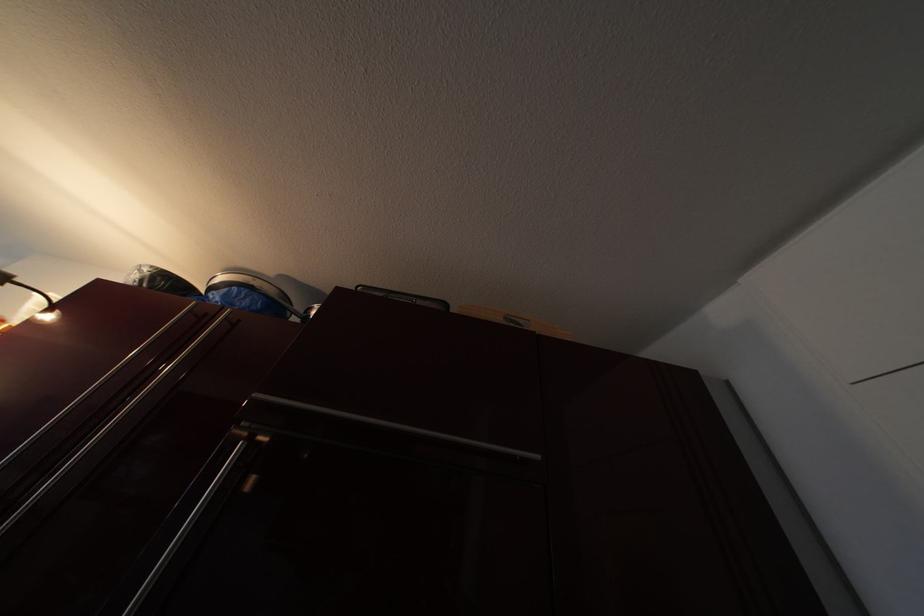
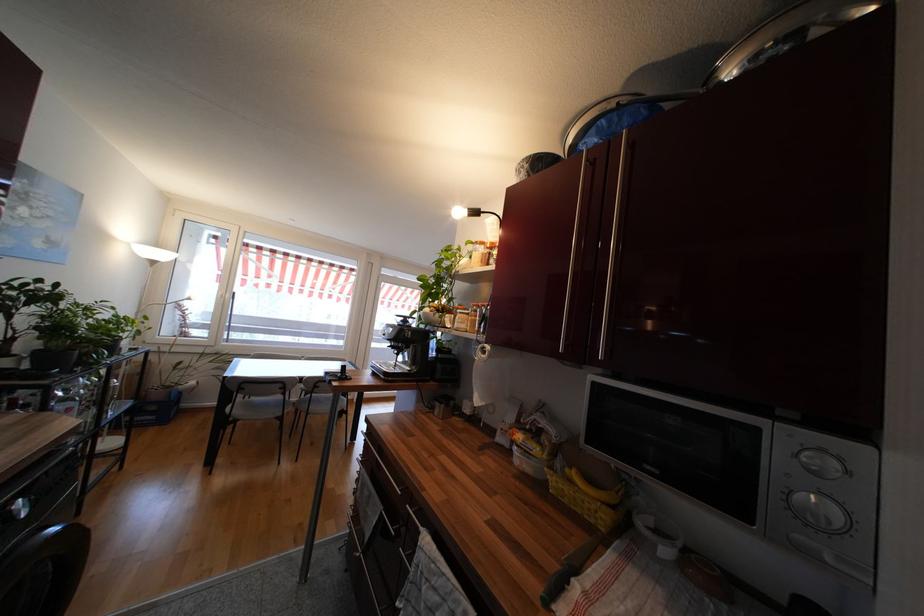
Where in the second image is the point corresponding to [144,273] from the first image?

(527, 168)